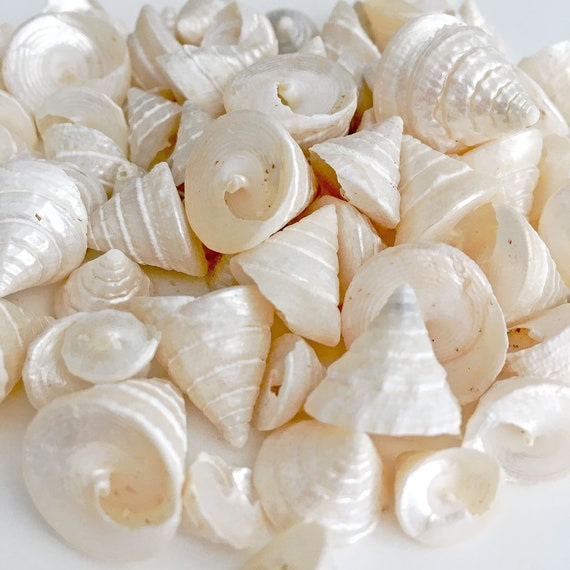
You are a GUI agent. You are given a task and a screenshot of the screen. Output one action in this format:
    pyautogui.click(x=<x>, y=<y>)
    Task: Click on the table
    The width and height of the screenshot is (570, 570).
    Given the screenshot: What is the action you would take?
    pyautogui.click(x=512, y=540)